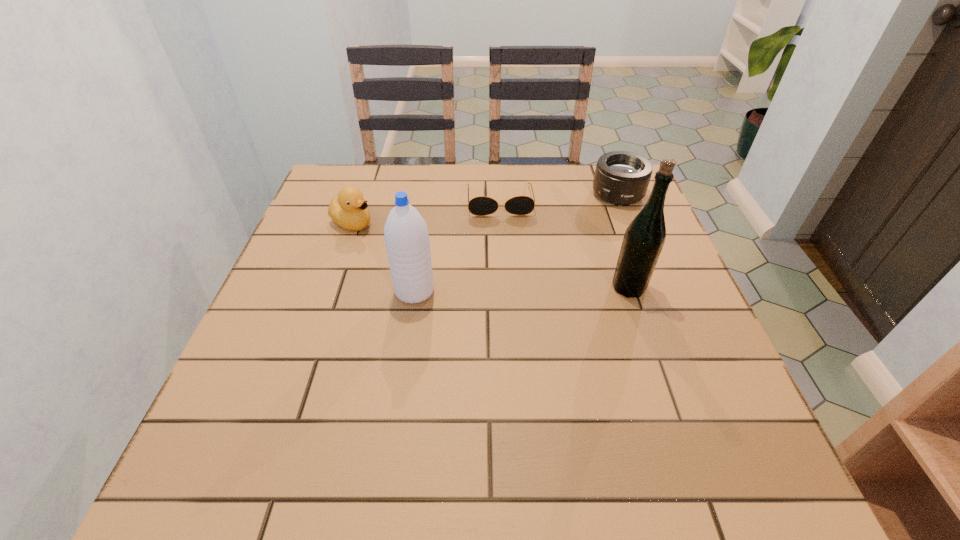
What are the coordinates of `vacant space that satisfies the following two spatial constraints: 1. on the back side of the telephoto lens; 2. on the left side of the water bottle` in the screenshot? It's located at (429, 194).

The width and height of the screenshot is (960, 540). In order to click on vacant position in the image that satisfies the following two spatial constraints: 1. on the back side of the duckling; 2. on the right side of the third object from right to left in this screenshot , I will do `click(360, 200)`.